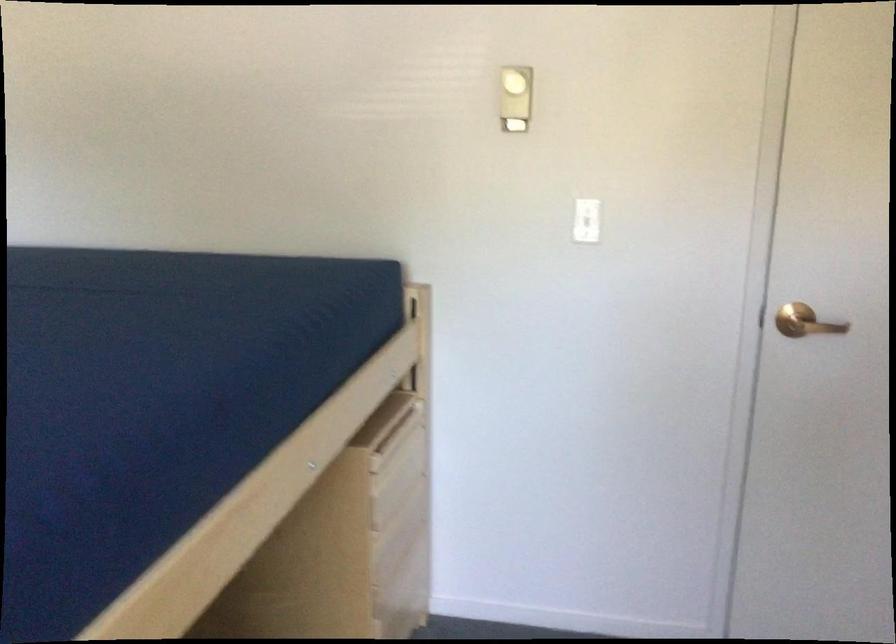
Image resolution: width=896 pixels, height=644 pixels. What do you see at coordinates (586, 220) in the screenshot?
I see `a light fixture switch` at bounding box center [586, 220].